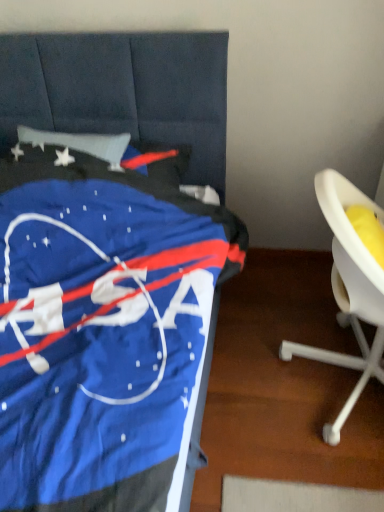
Question: Is blue fabric nasa bedspread at left taller or shorter than white plastic chair at right?

Choices:
 (A) tall
 (B) short

Answer: (B)

Question: From a real-world perspective, relative to white plastic chair at right, is blue fabric nasa bedspread at left vertically above or below?

Choices:
 (A) above
 (B) below

Answer: (A)

Question: Is blue fabric nasa bedspread at left inside or outside of white plastic chair at right?

Choices:
 (A) inside
 (B) outside

Answer: (B)

Question: Visually, is white plastic chair at right positioned to the left or to the right of blue fabric nasa bedspread at left?

Choices:
 (A) left
 (B) right

Answer: (B)

Question: From a real-world perspective, relative to blue fabric nasa bedspread at left, is white plastic chair at right vertically above or below?

Choices:
 (A) below
 (B) above

Answer: (A)

Question: From their relative heights in the image, would you say white plastic chair at right is taller or shorter than blue fabric nasa bedspread at left?

Choices:
 (A) short
 (B) tall

Answer: (B)

Question: Looking at their shapes, would you say white plastic chair at right is wider or thinner than blue fabric nasa bedspread at left?

Choices:
 (A) wide
 (B) thin

Answer: (B)